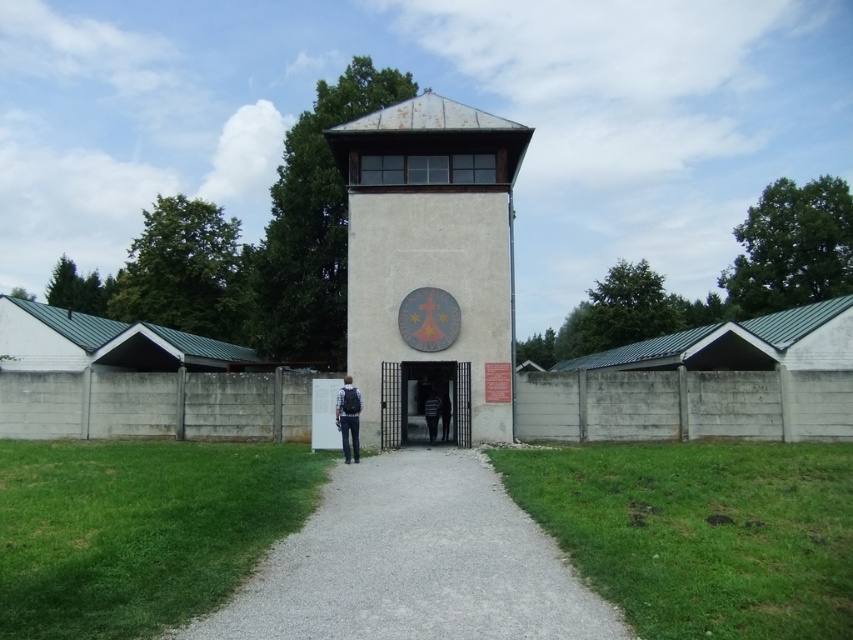
You are standing at the entrance of the historical site and want to take a photo of the smooth concrete gate at center. According to the coordinates provided, where should you position yourself to capture the gate in the center of your camera frame?

The smooth concrete gate at center is located at coordinates point (436, 401), so you should position yourself directly in front of the gate at that coordinate point to center it in your camera frame.

You are standing at the camera position and want to reach point (281,556) as quickly as possible. What is the shortest distance you need to walk?

The shortest distance you need to walk to reach point (281,556) is 6.21 meters.